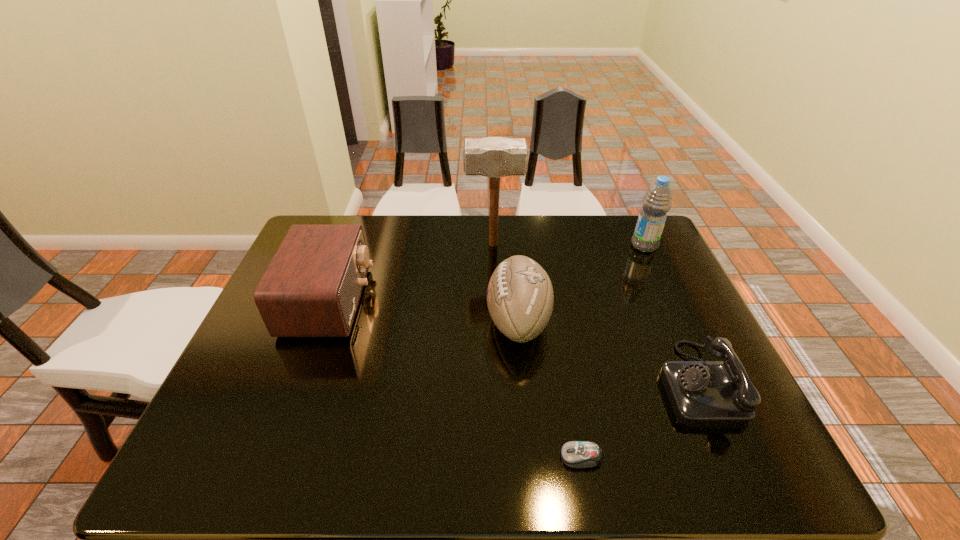
Where is `vacant area between the football (American) and the nearest object`? This screenshot has width=960, height=540. vacant area between the football (American) and the nearest object is located at coordinates (550, 388).

The height and width of the screenshot is (540, 960). I want to click on free space that is in between the water bottle and the mallet, so click(568, 245).

This screenshot has width=960, height=540. Identify the location of free space between the football (American) and the water bottle. (581, 283).

Locate an element on the screen. unoccupied position between the telephone and the leftmost object is located at coordinates (513, 342).

Identify the location of empty location between the nearest object and the telephone. The width and height of the screenshot is (960, 540). (639, 420).

The width and height of the screenshot is (960, 540). I want to click on the second closest object to the radio receiver, so click(x=520, y=298).

The width and height of the screenshot is (960, 540). Identify the location of the third closest object relative to the nearest object. (312, 287).

Where is `blank space that satisfies the following two spatial constraints: 1. on the front side of the water bottle; 2. on the wheel side of the computer mouse`? This screenshot has width=960, height=540. blank space that satisfies the following two spatial constraints: 1. on the front side of the water bottle; 2. on the wheel side of the computer mouse is located at coordinates (742, 457).

Locate an element on the screen. vacant area that satisfies the following two spatial constraints: 1. on the striking face of the fifth shortest object; 2. on the right side of the mallet is located at coordinates (493, 246).

What are the coordinates of `blank space that satisfies the following two spatial constraints: 1. on the striking face of the mallet; 2. on the left side of the water bottle` in the screenshot? It's located at (493, 246).